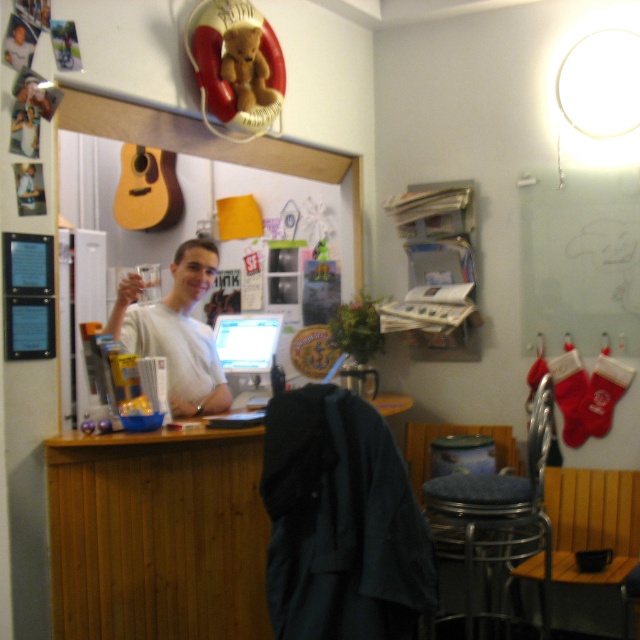
You are organizing items on a shelf above a desk. You have a white matte shirt at center and a matte plastic computer at center. Which item should you place higher to ensure the computer is not obstructed by the shirt?

The white matte shirt at center should be placed higher than the matte plastic computer at center to ensure the computer is not obstructed by the shirt.

You are a delivery robot with a package that is 4 feet long. You need to place the package between the metallic stool at lower center and the white matte shirt at center. Is there enough space?

The metallic stool at lower center is 4.38 feet from the white matte shirt at center, so yes, there is enough space to place the 4 feet long package between them since the distance is slightly larger than the package.